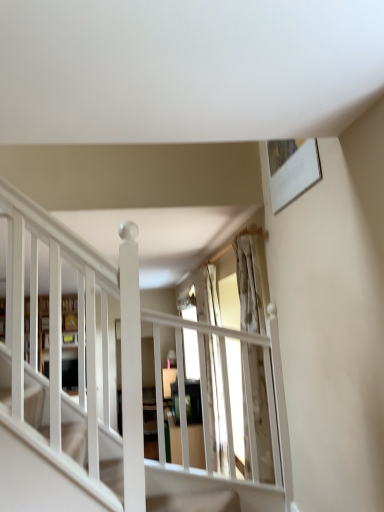
Describe the element at coordinates (70, 339) in the screenshot. I see `white wooden shelf at left` at that location.

Find the location of a particular element. Image resolution: width=384 pixels, height=512 pixels. wooden bookshelf at left is located at coordinates (70, 342).

Where is `translucent glass window at center`? translucent glass window at center is located at coordinates (249, 281).

From the image's perspective, between wooden bookshelf at left and white wooden shelf at left, who is located below?

wooden bookshelf at left appears lower in the image.

The width and height of the screenshot is (384, 512). What are the coordinates of `shelf on the right of wooden bookshelf at left` in the screenshot? It's located at (70, 339).

Which of these two, wooden bookshelf at left or white wooden shelf at left, is thinner?

Thinner between the two is white wooden shelf at left.

Which is closer to the camera, (x=67, y=374) or (x=76, y=338)?

Point (x=67, y=374) is farther from the camera than point (x=76, y=338).

From a real-world perspective, is translucent glass window at center physically below white wooden shelf at left?

Yes, from a real-world perspective, translucent glass window at center is below white wooden shelf at left.

In the scene shown: In terms of width, does translucent glass window at center look wider or thinner when compared to white wooden shelf at left?

Clearly, translucent glass window at center has more width compared to white wooden shelf at left.

Could you tell me if translucent glass window at center is turned towards white wooden shelf at left?

No, translucent glass window at center is not oriented towards white wooden shelf at left.

Is translucent glass window at center to the right of white wooden shelf at left from the viewer's perspective?

Yes.

The image size is (384, 512). I want to click on shelf above the wooden bookshelf at left (from a real-world perspective), so click(x=70, y=339).

From a real-world perspective, is white wooden shelf at left located beneath wooden bookshelf at left?

No, from a real-world perspective, white wooden shelf at left is not under wooden bookshelf at left.

From the picture: Considering the sizes of white wooden shelf at left and wooden bookshelf at left in the image, is white wooden shelf at left taller or shorter than wooden bookshelf at left?

Clearly, white wooden shelf at left is shorter compared to wooden bookshelf at left.

Is white wooden shelf at left facing towards wooden bookshelf at left?

Yes.

Is wooden bookshelf at left outside of translucent glass window at center?

wooden bookshelf at left is positioned outside translucent glass window at center.

Consider the image. Considering the relative positions of wooden bookshelf at left and translucent glass window at center in the image provided, is wooden bookshelf at left to the left or to the right of translucent glass window at center?

Clearly, wooden bookshelf at left is on the left of translucent glass window at center in the image.

Considering the relative sizes of wooden bookshelf at left and translucent glass window at center in the image provided, is wooden bookshelf at left taller than translucent glass window at center?

In fact, wooden bookshelf at left may be shorter than translucent glass window at center.

Considering the positions of point (47, 359) and point (248, 325), is point (47, 359) closer or farther from the camera than point (248, 325)?

Clearly, point (47, 359) is closer to the camera than point (248, 325).

Would you say translucent glass window at center is outside wooden bookshelf at left?

Yes.

Does point (260, 275) appear closer or farther from the camera than point (27, 334)?

Point (260, 275).

Which of these two, translucent glass window at center or wooden bookshelf at left, stands shorter?

wooden bookshelf at left.

From a real-world perspective, does translucent glass window at center stand above wooden bookshelf at left?

No.

Which of these two, white wooden shelf at left or translucent glass window at center, stands taller?

translucent glass window at center.

Identify the location of window on the right side of white wooden shelf at left. (249, 281).

Does white wooden shelf at left turn towards translucent glass window at center?

Yes, white wooden shelf at left is facing translucent glass window at center.

Can translucent glass window at center be found inside white wooden shelf at left?

No, translucent glass window at center is not inside white wooden shelf at left.

At what (x,y) coordinates should I click in order to perform the action: click on shelf lying behind the wooden bookshelf at left. Please return your answer as a coordinate pair (x, y). Looking at the image, I should click on (70, 339).

Where is `window on the right of white wooden shelf at left`? Image resolution: width=384 pixels, height=512 pixels. window on the right of white wooden shelf at left is located at coordinates (249, 281).

Looking at the image, which one is located further to translucent glass window at center, white wooden shelf at left or wooden bookshelf at left?

white wooden shelf at left is positioned further to the anchor translucent glass window at center.

When comparing their distances from translucent glass window at center, does wooden bookshelf at left or white wooden shelf at left seem closer?

Based on the image, wooden bookshelf at left appears to be nearer to translucent glass window at center.

From the picture: From the image, which object appears to be nearer to white wooden shelf at left, wooden bookshelf at left or translucent glass window at center?

The object closer to white wooden shelf at left is wooden bookshelf at left.

Estimate the real-world distances between objects in this image. Which object is further from wooden bookshelf at left, white wooden shelf at left or translucent glass window at center?

Among the two, translucent glass window at center is located further to wooden bookshelf at left.

Consider the image. When comparing their distances from wooden bookshelf at left, does translucent glass window at center or white wooden shelf at left seem closer?

white wooden shelf at left is closer to wooden bookshelf at left.

When comparing their distances from white wooden shelf at left, does translucent glass window at center or wooden bookshelf at left seem closer?

wooden bookshelf at left lies closer to white wooden shelf at left than the other object.

At what (x,y) coordinates should I click in order to perform the action: click on bookshelf between translucent glass window at center and white wooden shelf at left along the z-axis. Please return your answer as a coordinate pair (x, y). The image size is (384, 512). Looking at the image, I should click on (70, 342).